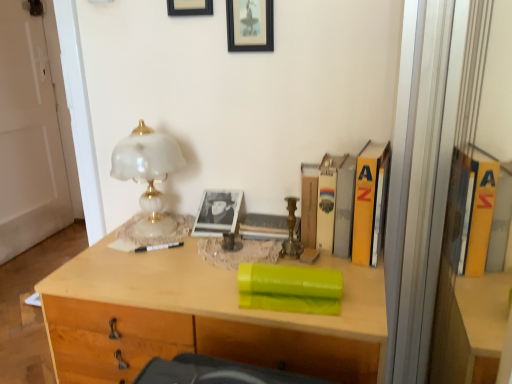
At what (x,y) coordinates should I click in order to perform the action: click on vacant region in front of hardcover book at upper right, the first book in the back-to-front sequence. Please return your answer as a coordinate pair (x, y). Looking at the image, I should click on (364, 283).